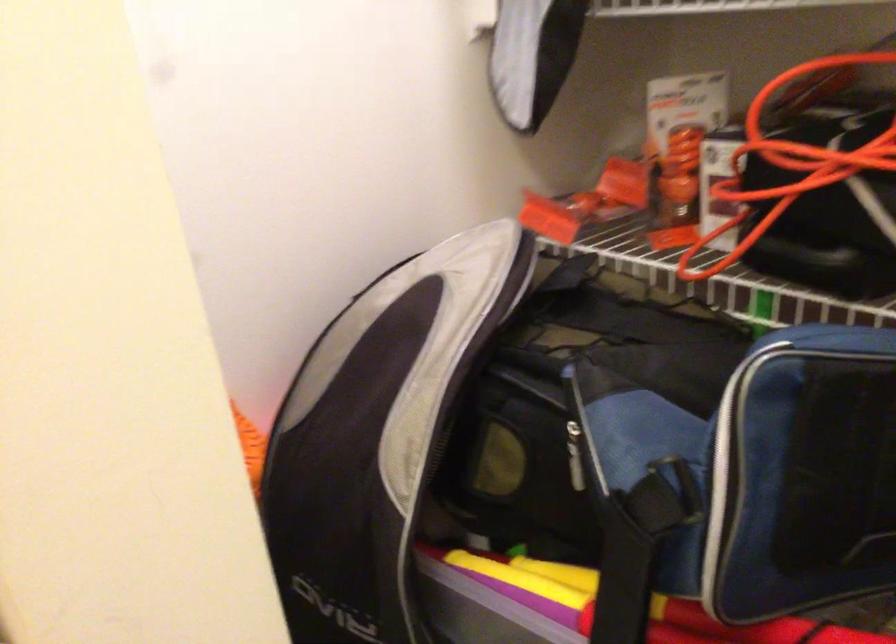
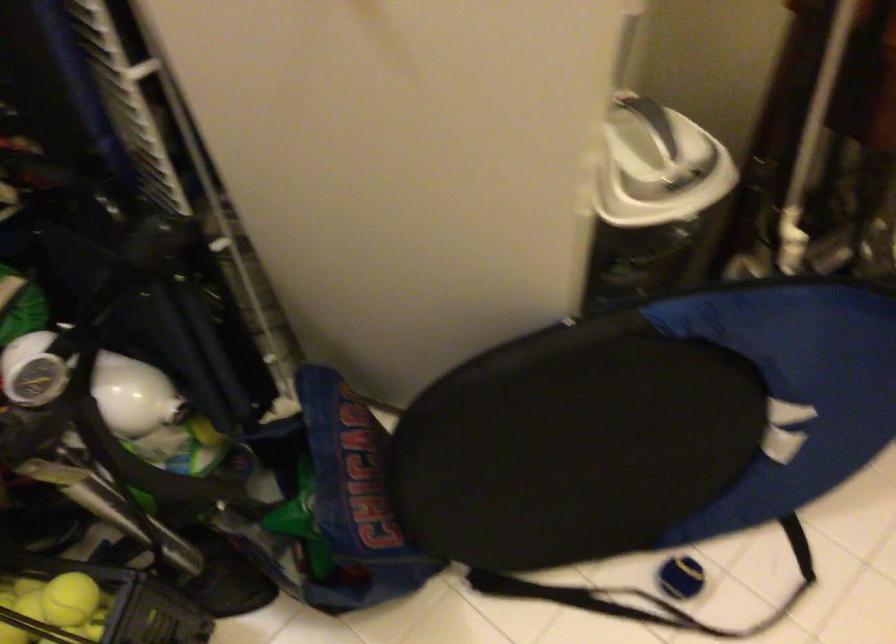
First-person continuous shooting, in which direction is the camera rotating?

The camera's rotation is toward right-down.